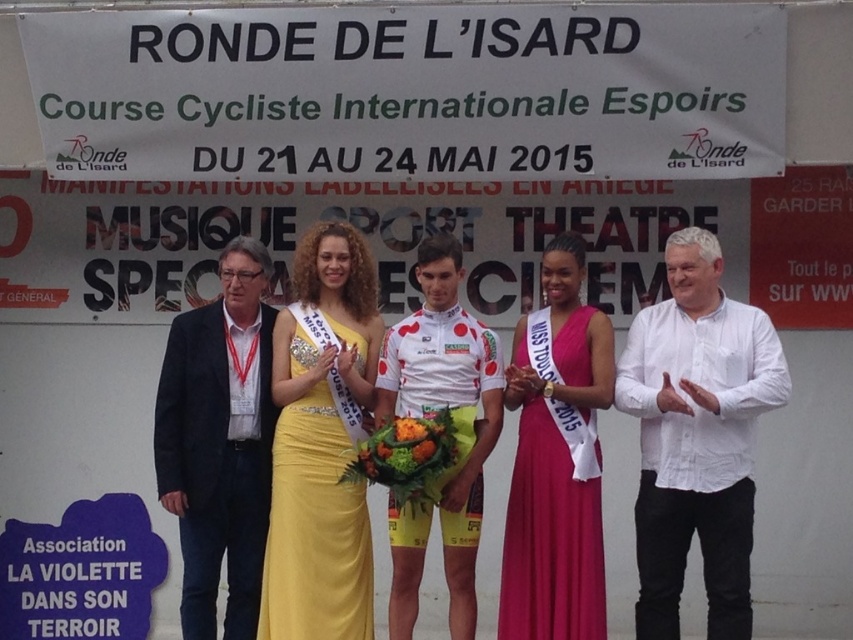
You are a photographer standing behind the podium. You need to capture a photo of the dark blue suit at left and the yellow satin dress at center. Given that your camera has a maximum focus range of 18 inches, can you ensure both subjects are in focus without moving?

The distance between the dark blue suit at left and the yellow satin dress at center is 20.04 inches. Since the camera can only focus within 18 inches, the subjects are slightly out of the focus range. You may need to adjust your position or equipment to ensure clarity.

You are an event photographer at the Ronde de l Isard cycling event. You need to capture a photo where the dark blue suit at left and the yellow satin dress at center are both visible. Based on their positions, which one should you ensure is closer to the front of the frame to include both in the photo?

The dark blue suit at left is above the yellow satin dress at center, so to include both in the photo, ensure the dark blue suit at left is closer to the front of the frame.

You are a photographer at the event and need to position yourself to capture both the dark blue suit at left and the pink satin dress at center in the same frame. Considering their positions and possible widths, which side of the frame should you prioritize to include both subjects?

The dark blue suit at left might be wider than the pink satin dress at center, so positioning the camera slightly to the left side of the frame would help include both subjects while accommodating the potential width of the dark blue suit at left.